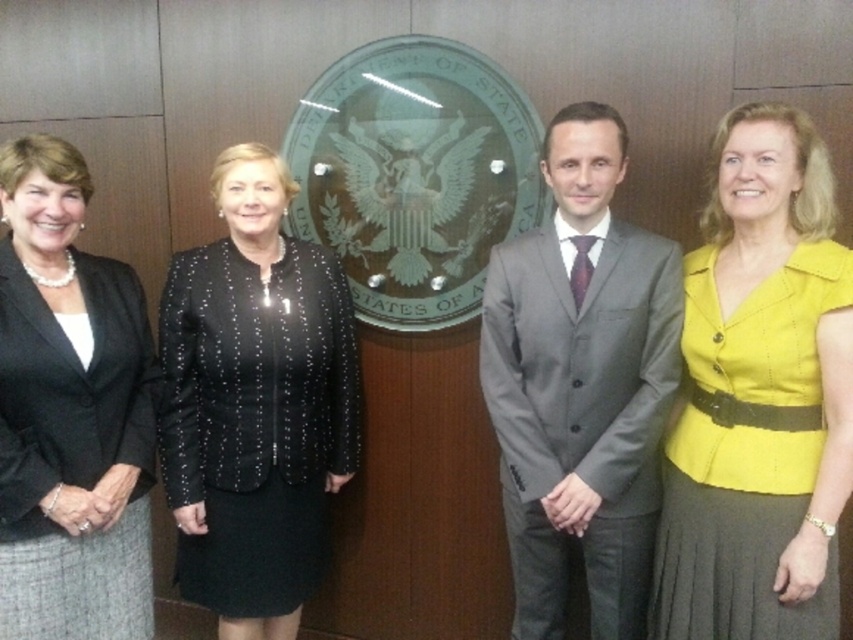
Question: Which of the following is the closest to the observer?

Choices:
 (A) (848, 292)
 (B) (61, 196)
 (C) (544, 483)

Answer: (A)

Question: Is gray suit at center above black textured blazer at center?

Choices:
 (A) yes
 (B) no

Answer: (A)

Question: Which object appears farthest from the camera in this image?

Choices:
 (A) yellow fabric dress at right
 (B) gray suit at center
 (C) matte black blazer at left
 (D) black textured blazer at center

Answer: (D)

Question: Among these objects, which one is farthest from the camera?

Choices:
 (A) black textured blazer at center
 (B) yellow fabric dress at right
 (C) gray suit at center
 (D) matte black blazer at left

Answer: (A)

Question: Can you confirm if black textured blazer at center is positioned above matte black blazer at left?

Choices:
 (A) yes
 (B) no

Answer: (B)

Question: Is gray suit at center smaller than black textured blazer at center?

Choices:
 (A) yes
 (B) no

Answer: (A)